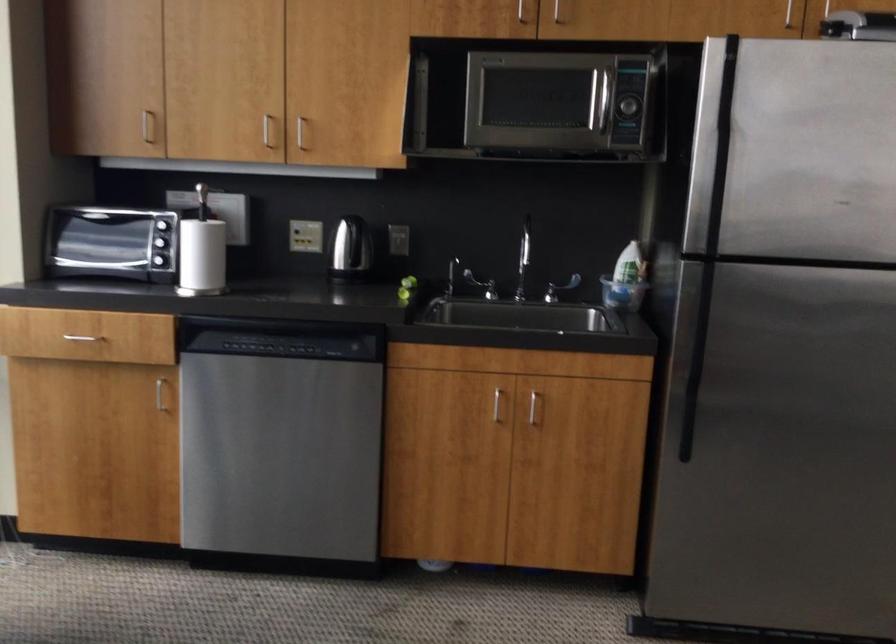
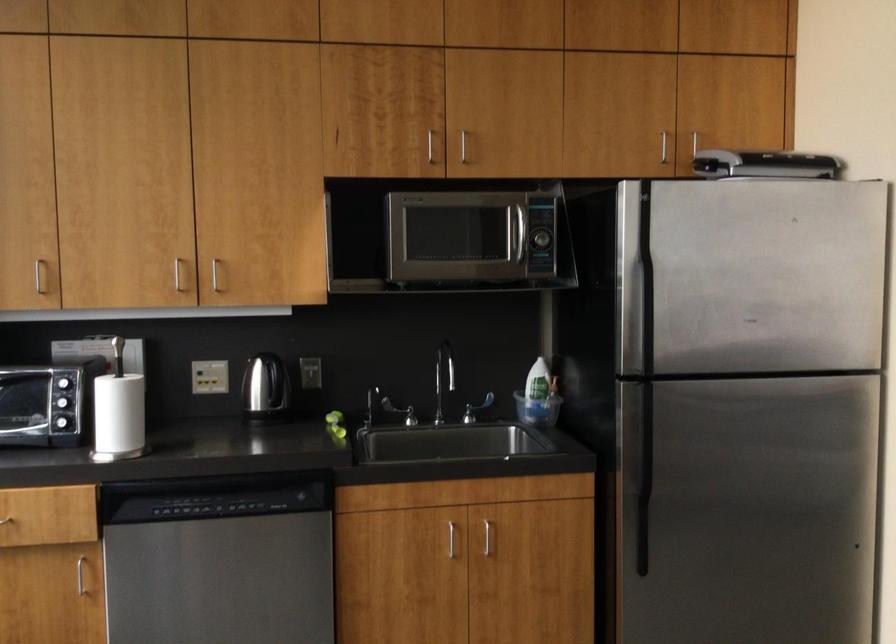
Question: What movement of the cameraman would produce the second image?

Choices:
 (A) Left
 (B) Right
 (C) Forward
 (D) Backward

Answer: (A)